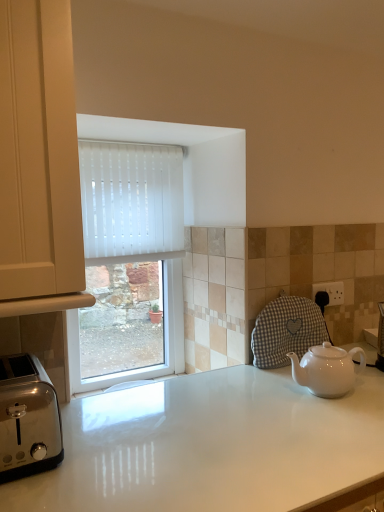
I want to click on vacant space underneath white ceramic teapot at lower right (from a real-world perspective), so click(327, 393).